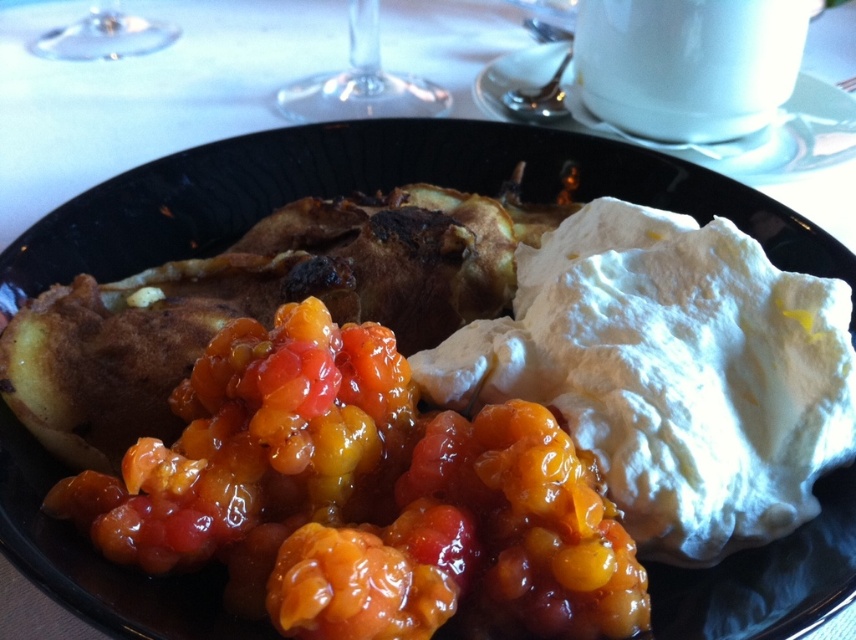
Question: Which point is farther to the camera?

Choices:
 (A) (357, 45)
 (B) (147, 518)
 (C) (48, 38)

Answer: (C)

Question: Is transparent glass at upper center smaller than transparent glass at upper left?

Choices:
 (A) no
 (B) yes

Answer: (A)

Question: Does glistening orange jam at center appear under transparent glass at upper left?

Choices:
 (A) yes
 (B) no

Answer: (A)

Question: Among these objects, which one is farthest from the camera?

Choices:
 (A) transparent glass at upper left
 (B) glistening orange jam at center

Answer: (A)

Question: Is glistening orange jam at center wider than transparent glass at upper left?

Choices:
 (A) no
 (B) yes

Answer: (B)

Question: Which object is positioned closest to the transparent glass at upper left?

Choices:
 (A) glistening orange jam at center
 (B) transparent glass at upper center

Answer: (B)